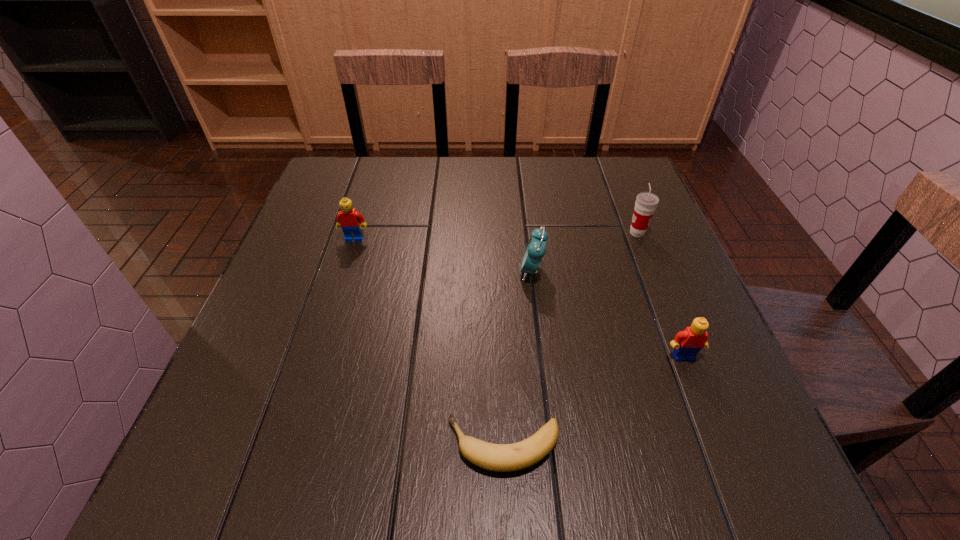
The width and height of the screenshot is (960, 540). What are the coordinates of `free space that is in between the fourth farthest object and the farther Lego` in the screenshot? It's located at (519, 298).

Locate an element on the screen. The image size is (960, 540). vacant space that is in between the left Lego and the nearer Lego is located at coordinates (519, 298).

At what (x,y) coordinates should I click in order to perform the action: click on empty space that is in between the second nearest object and the third farthest object. Please return your answer as a coordinate pair (x, y). The image size is (960, 540). Looking at the image, I should click on (608, 314).

This screenshot has height=540, width=960. What are the coordinates of `free point between the nearest object and the farther Lego` in the screenshot? It's located at (429, 342).

At what (x,y) coordinates should I click in order to perform the action: click on free space between the banana and the leftmost object. Please return your answer as a coordinate pair (x, y). The width and height of the screenshot is (960, 540). Looking at the image, I should click on (429, 342).

Where is `free space between the nearer Lego and the third farthest object`? The height and width of the screenshot is (540, 960). free space between the nearer Lego and the third farthest object is located at coordinates (608, 314).

You are a GUI agent. You are given a task and a screenshot of the screen. Output one action in this format:
    pyautogui.click(x=<x>, y=<y>)
    Task: Click on the vacant space that is in between the banana and the leftmost object
    The height and width of the screenshot is (540, 960).
    Given the screenshot: What is the action you would take?
    pyautogui.click(x=429, y=342)

At what (x,y) coordinates should I click in order to perform the action: click on vacant region between the alarm clock and the banana. Please return your answer as a coordinate pair (x, y). This screenshot has width=960, height=540. Looking at the image, I should click on (517, 358).

Find the location of a particular element. This screenshot has width=960, height=540. free spot between the shortest object and the alarm clock is located at coordinates (517, 358).

The width and height of the screenshot is (960, 540). Find the location of `the second closest object to the third farthest object`. the second closest object to the third farthest object is located at coordinates (686, 344).